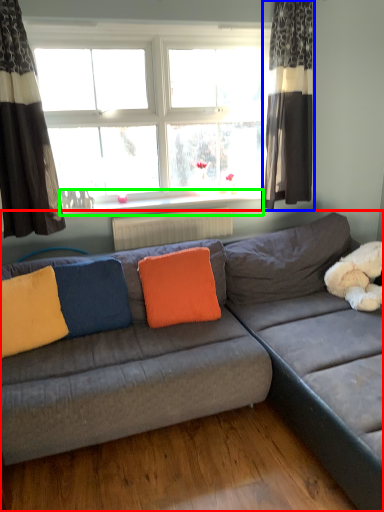
Question: Considering the real-world distances, which object is closest to studio couch (highlighted by a red box)? curtain (highlighted by a blue box) or window sill (highlighted by a green box).

Choices:
 (A) curtain
 (B) window sill

Answer: (A)